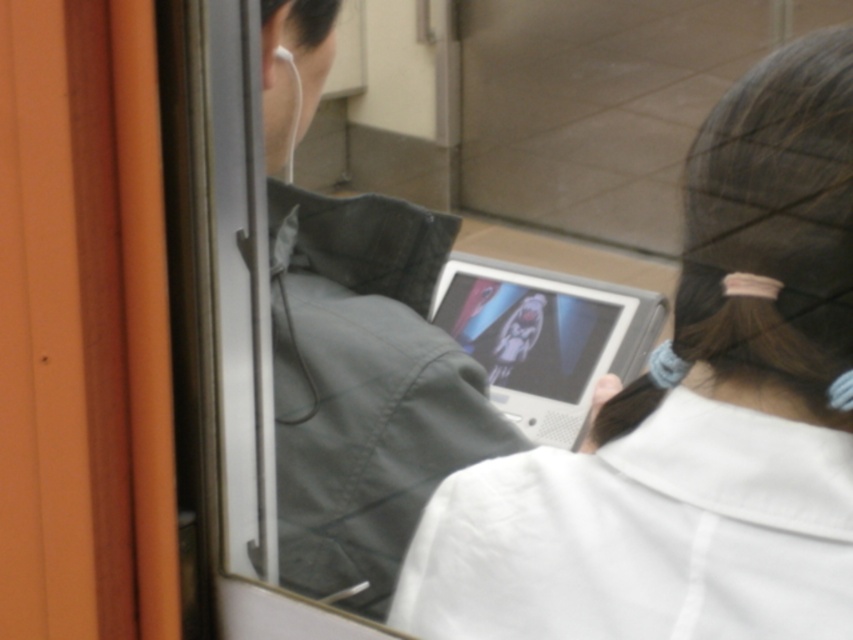
From the picture: You are a passenger on a train and want to borrow the white matte earphone at upper left from the person in the background. However, you need to reach over the silver metallic tablet at center to get it. Can you safely do so without touching the tablet?

The silver metallic tablet at center is further to the viewer than white matte earphone at upper left, so the tablet is closer to you. This means the earphone is behind the tablet, making it difficult to reach without moving the tablet first.

You are a passenger on a train and need to place your white matte laptop at center and white matte earphone at upper left on the table. Based on their positions, which object should you move first to free up space for a new item?

The white matte earphone at upper left should be moved first because it is positioned to the left of the white matte laptop at center, so moving it first would create space for the new item.